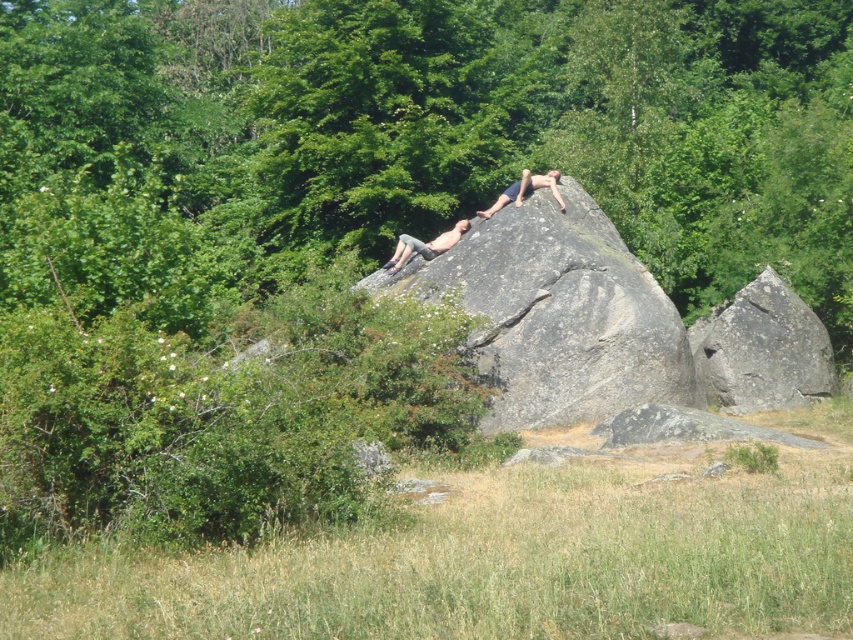
You are standing at the point marked by the coordinate point [762,349] in the image. Looking around, you see a gray rough rock at lower right. Which direction should you face to look towards the gray rough rock at lower right?

The gray rough rock at lower right is located at the point marked by the coordinate point [762,349], so you are already facing it.

You are planning to set up a small campsite and need a flat surface. You see two rocks in the image, the gray rough rock at center and the smooth gray rock at upper center. Which rock would be more suitable for placing your camping gear?

The smooth gray rock at upper center would be more suitable for placing camping gear because it has a smoother surface, which provides a flatter and more stable base compared to the gray rough rock at center with its rough texture.

Based on the photo, you are planning to set up a small campfire between the gray rough rock at center and the smooth gray rock at upper center. Given that the recommended safe distance for a campfire is at least 2 meters from any flammable objects, is the space between these two rocks sufficient?

The gray rough rock at center and smooth gray rock at upper center are 1.78 meters apart. Since the recommended safe distance is 2 meters, the space between them is insufficient for a campfire.